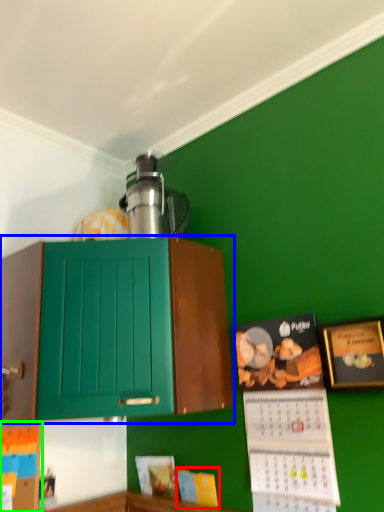
Question: Considering the real-world distances, which object is closest to book (highlighted by a red box)? cabinetry (highlighted by a blue box) or book (highlighted by a green box).

Choices:
 (A) cabinetry
 (B) book

Answer: (B)